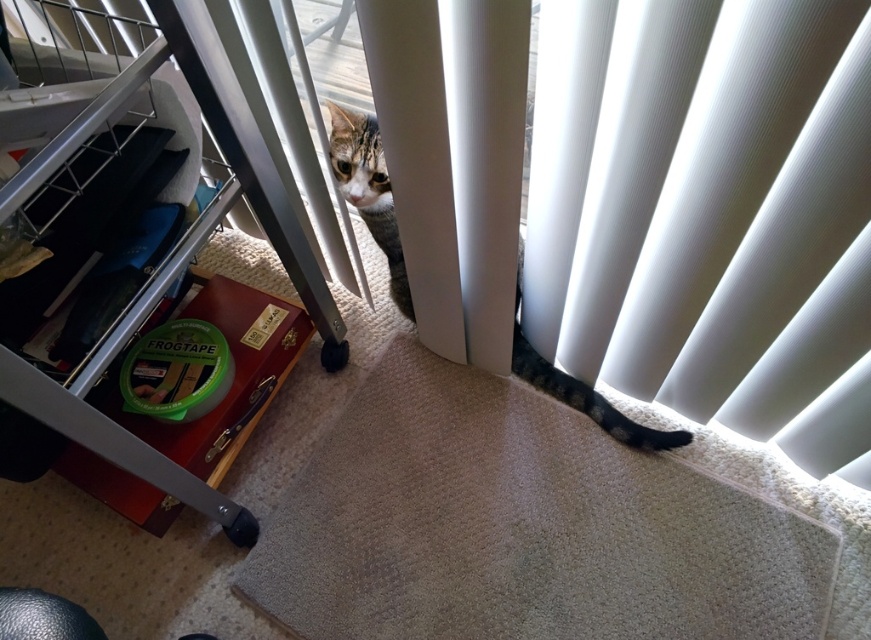
Can you confirm if white textured blinds at lower right is positioned above brushed metal drawer at lower left?

Indeed, white textured blinds at lower right is positioned over brushed metal drawer at lower left.

Does white textured blinds at lower right have a larger size compared to brushed metal drawer at lower left?

No.

Measure the distance between point (618, 246) and camera.

Point (618, 246) and camera are 37.94 inches apart from each other.

Locate an element on the screen. This screenshot has width=871, height=640. white textured blinds at lower right is located at coordinates (714, 212).

Is point (690, 48) positioned before point (652, 429)?

Yes, point (690, 48) is closer to viewer.

Does point (538, 72) lie behind point (515, 310)?

No.

Locate an element on the screen. white textured blinds at lower right is located at coordinates (714, 212).

Is brushed metal drawer at lower left in front of tabby fur cat at center?

Yes, it is in front of tabby fur cat at center.

Is point (61, 204) positioned behind point (608, 404)?

No.

Between point (152, 499) and point (376, 163), which one is positioned in front?

Point (376, 163) is in front.

Locate an element on the screen. The height and width of the screenshot is (640, 871). brushed metal drawer at lower left is located at coordinates (161, 268).